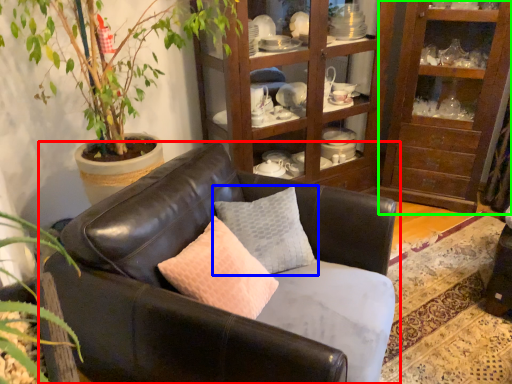
Question: Estimate the real-world distances between objects in this image. Which object is farther from studio couch (highlighted by a red box), pillow (highlighted by a blue box) or shelf (highlighted by a green box)?

Choices:
 (A) pillow
 (B) shelf

Answer: (B)